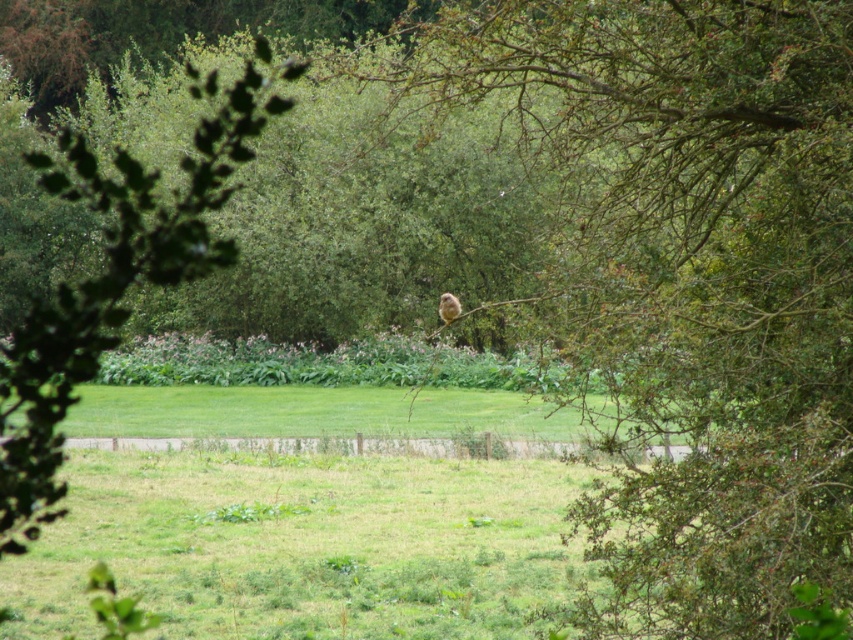
Question: Is brown textured branch at center to the left of green leafy tree at upper left from the viewer's perspective?

Choices:
 (A) no
 (B) yes

Answer: (A)

Question: Which point is closer to the camera?

Choices:
 (A) green leafy tree at upper left
 (B) brown textured branch at center

Answer: (B)

Question: Does green leafy tree at upper left appear under fuzzy brown bird at center?

Choices:
 (A) no
 (B) yes

Answer: (A)

Question: Which point is farther from the camera taking this photo?

Choices:
 (A) (650, 387)
 (B) (442, 300)

Answer: (B)

Question: Is brown textured branch at center bigger than green leafy tree at upper left?

Choices:
 (A) no
 (B) yes

Answer: (A)

Question: Which is farther from the fuzzy brown bird at center?

Choices:
 (A) brown textured branch at center
 (B) green leafy tree at upper left

Answer: (B)